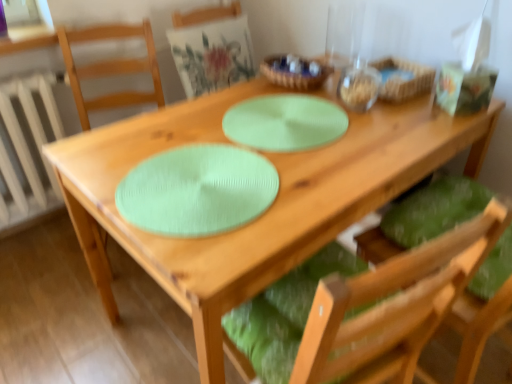
Image resolution: width=512 pixels, height=384 pixels. I want to click on vacant space in front of woven wood basket at upper right, so click(x=409, y=114).